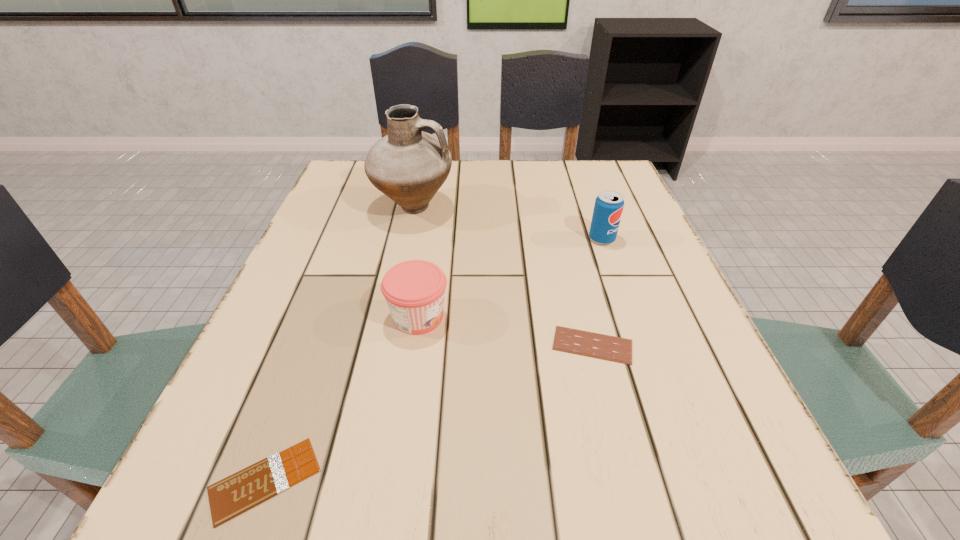
Locate an element on the screen. unoccupied area between the jam and the shorter chocolate bar is located at coordinates (342, 398).

Find the location of a particular element. Image resolution: width=960 pixels, height=540 pixels. free area in between the soda can and the shorter chocolate bar is located at coordinates (434, 359).

Where is `vacant area that lies between the tallest object and the soda can`? The image size is (960, 540). vacant area that lies between the tallest object and the soda can is located at coordinates click(x=508, y=224).

In order to click on vacant area that lies between the soda can and the pitcher in this screenshot , I will do `click(508, 224)`.

Identify the location of free area in between the soda can and the pitcher. (508, 224).

This screenshot has height=540, width=960. Identify the location of the third closest object to the farther chocolate bar. (409, 166).

In order to click on object identified as the closest to the third tallest object in this screenshot , I will do `click(590, 344)`.

Find the location of a particular element. This screenshot has height=540, width=960. free spot that satisfies the following two spatial constraints: 1. on the front label of the jam; 2. on the right side of the taller chocolate bar is located at coordinates (414, 345).

Find the location of a particular element. Image resolution: width=960 pixels, height=540 pixels. free spot that satisfies the following two spatial constraints: 1. on the front label of the jam; 2. on the left side of the taller chocolate bar is located at coordinates (414, 345).

Identify the location of blank area in the image that satisfies the following two spatial constraints: 1. on the front label of the third shortest object; 2. on the right side of the farther chocolate bar. Image resolution: width=960 pixels, height=540 pixels. (414, 345).